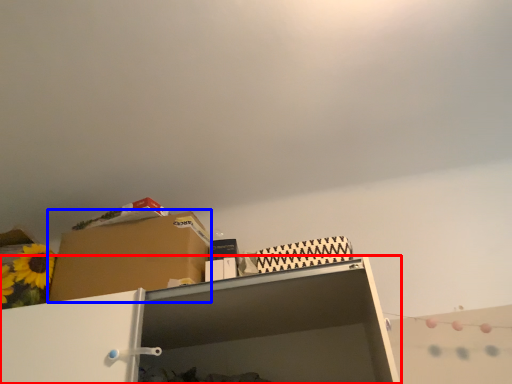
Question: Which object is closer to the camera taking this photo, shelf (highlighted by a red box) or cardboard box (highlighted by a blue box)?

Choices:
 (A) shelf
 (B) cardboard box

Answer: (A)